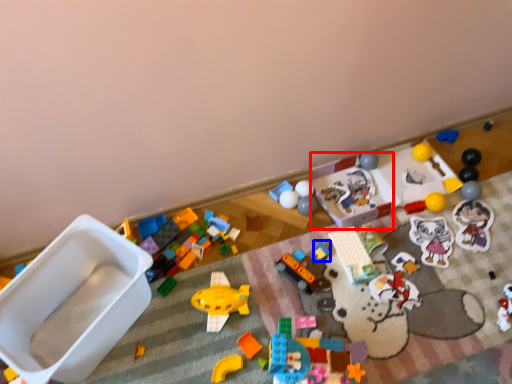
Question: Which object appears farthest to the camera in this image, toy (highlighted by a red box) or toy (highlighted by a blue box)?

Choices:
 (A) toy
 (B) toy

Answer: (A)